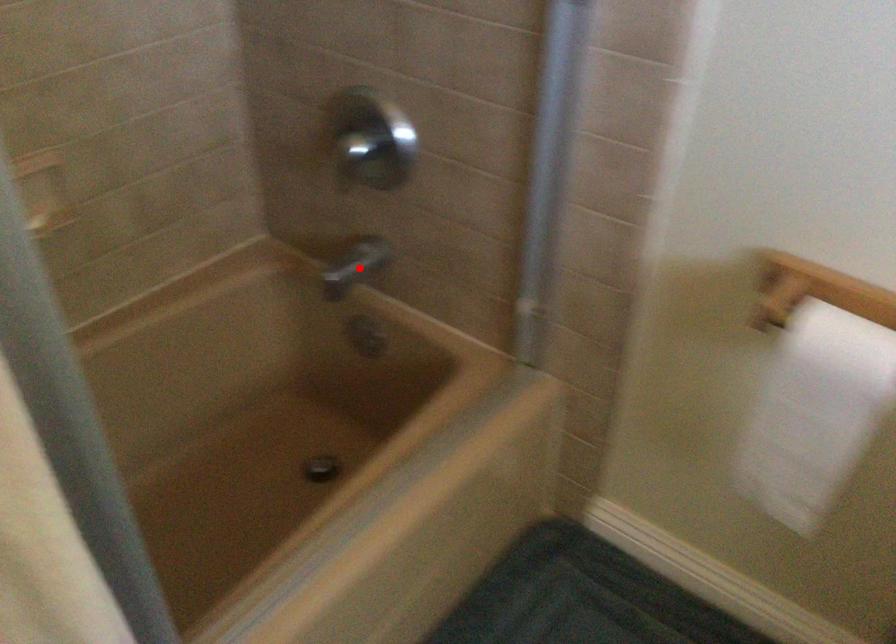
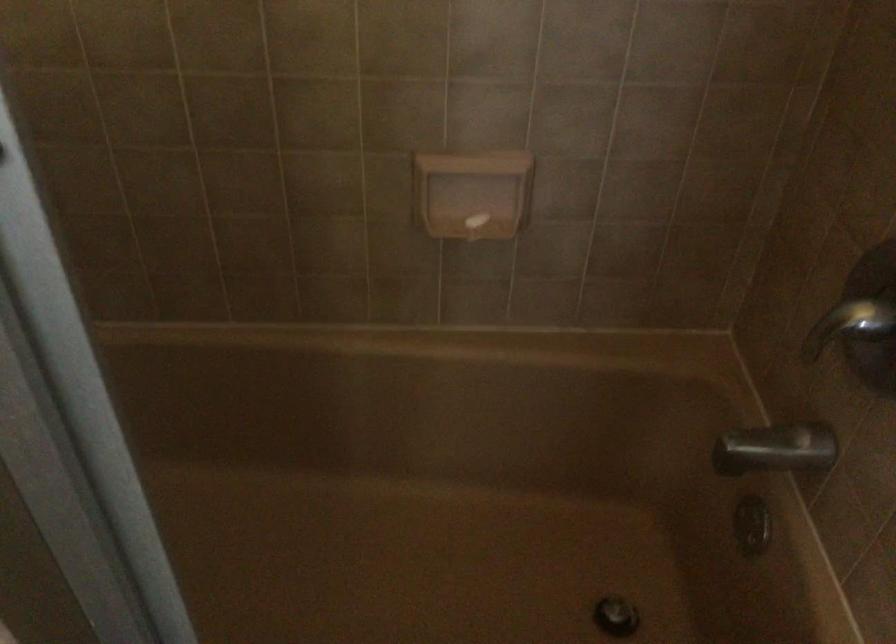
Question: I am providing you with two images of the same scene from different viewpoints. Image1 has a red point marked. In image2, the corresponding 3D location appears at what relative position? Reply with the corresponding letter.

Choices:
 (A) Closer
 (B) Farther

Answer: (A)